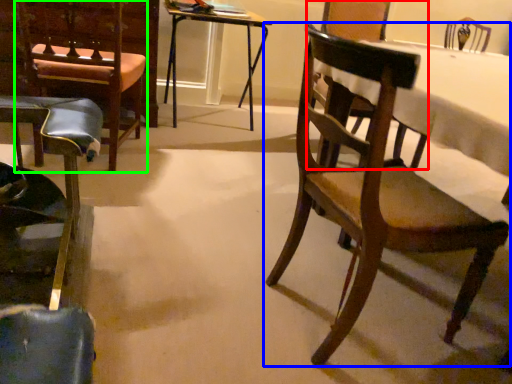
Question: Which object is the closest to the armchair (highlighted by a red box)? Choose among these: chair (highlighted by a blue box) or armchair (highlighted by a green box).

Choices:
 (A) chair
 (B) armchair

Answer: (B)